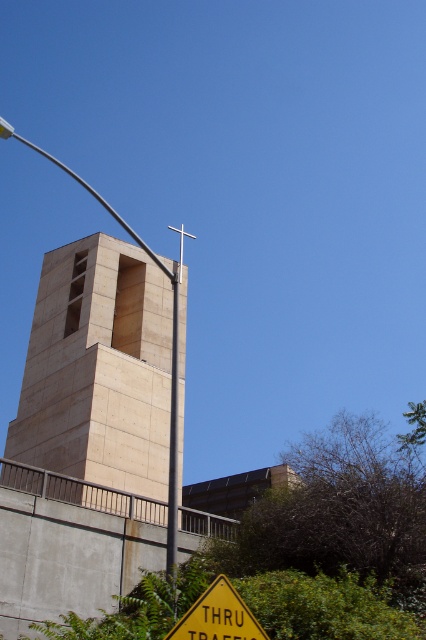
Question: Which point is closer to the camera?

Choices:
 (A) (71, 259)
 (B) (173, 484)
 (C) (210, 621)

Answer: (C)

Question: Is beige stone bell tower at center bigger than metallic gray pole at center?

Choices:
 (A) yes
 (B) no

Answer: (B)

Question: Which of the following is the farthest from the observer?

Choices:
 (A) (65, 301)
 (B) (176, 515)
 (C) (250, 632)

Answer: (A)

Question: Does beige stone bell tower at center have a smaller size compared to yellow matte traffic sign at lower center?

Choices:
 (A) no
 (B) yes

Answer: (A)

Question: Which point is farther from the camera taking this photo?

Choices:
 (A) (86, 301)
 (B) (218, 625)
 (C) (178, 273)

Answer: (A)

Question: Can you confirm if beige stone bell tower at center is thinner than yellow matte traffic sign at lower center?

Choices:
 (A) no
 (B) yes

Answer: (A)